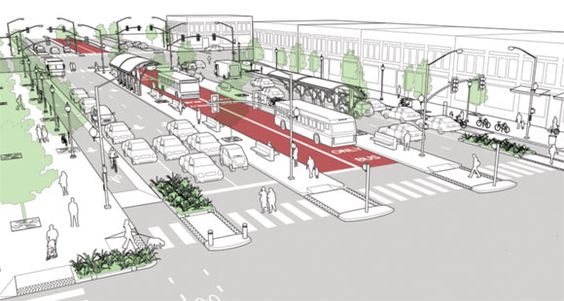
Locate an element on the screen. This screenshot has height=301, width=564. bench is located at coordinates (264, 150), (212, 125), (385, 136).